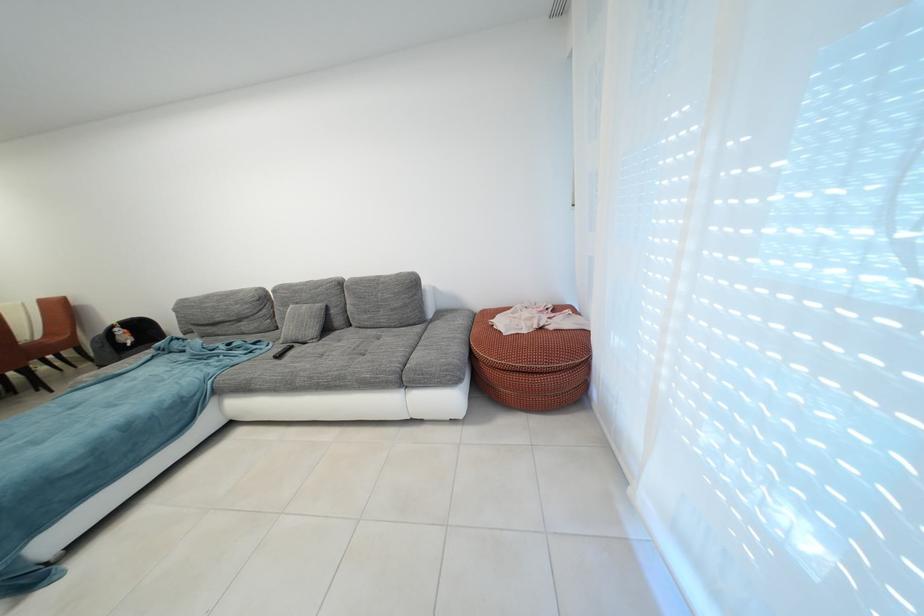
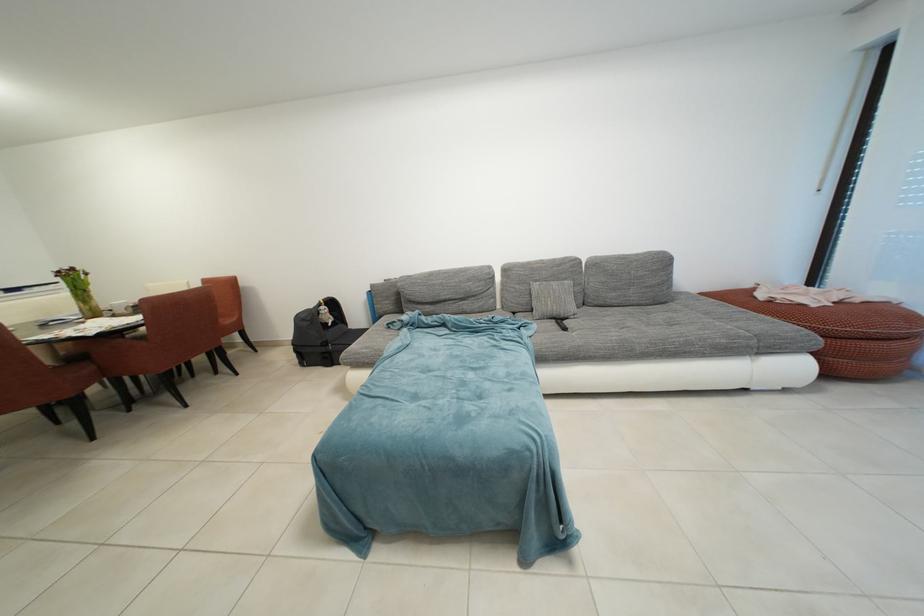
Find the pixel in the second image that matches (560,331) in the first image.

(865, 305)